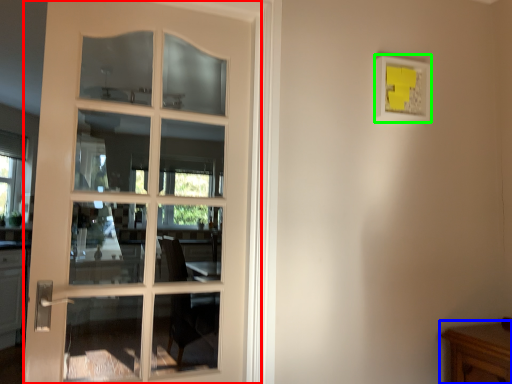
Question: Estimate the real-world distances between objects in this image. Which object is farther from door (highlighted by a red box), table (highlighted by a blue box) or picture frame (highlighted by a green box)?

Choices:
 (A) table
 (B) picture frame

Answer: (A)